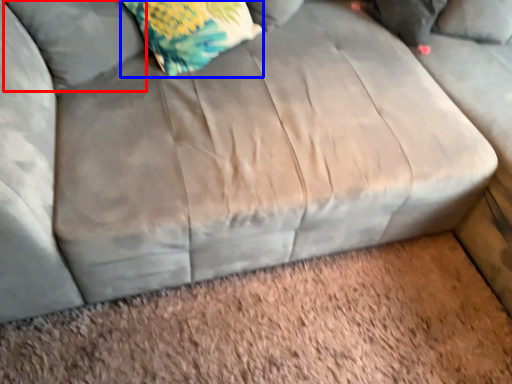
Question: Which point is closer to the camera, pillow (highlighted by a red box) or throw pillow (highlighted by a blue box)?

Choices:
 (A) pillow
 (B) throw pillow

Answer: (A)